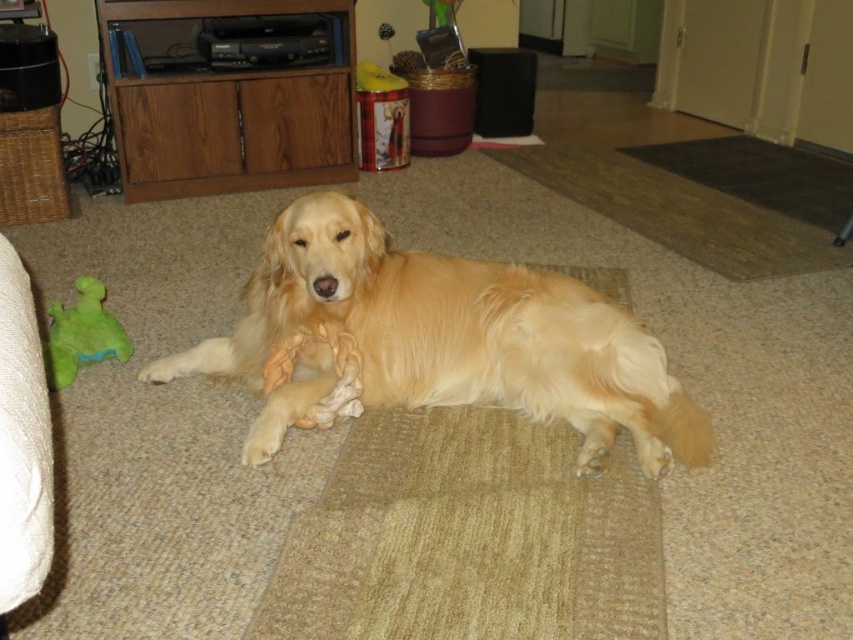
Consider the image. Does golden fur dog at center come behind green plush toy at left?

No, golden fur dog at center is closer to the viewer.

Is golden fur dog at center smaller than green plush toy at left?

No, golden fur dog at center is not smaller than green plush toy at left.

Where is `golden fur dog at center`? golden fur dog at center is located at coordinates (457, 336).